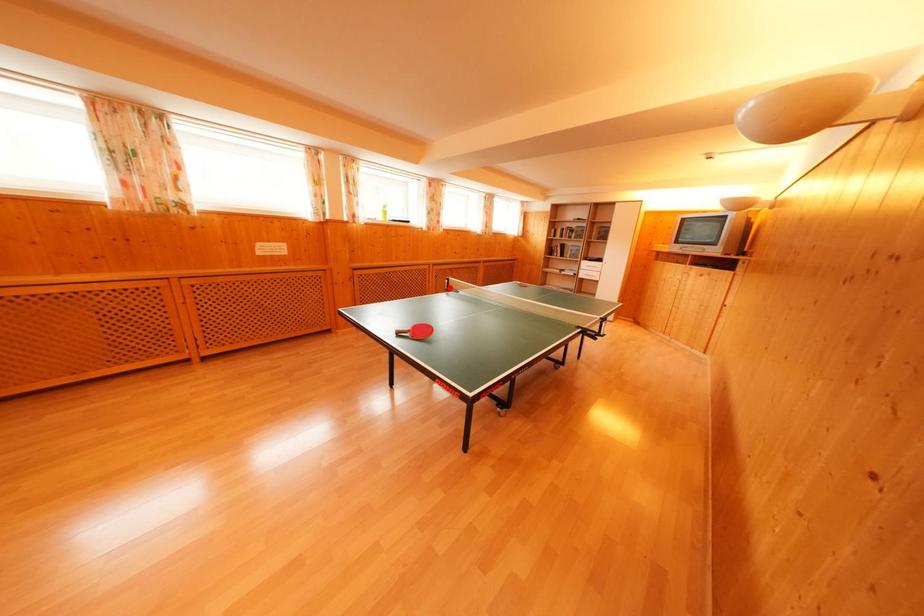
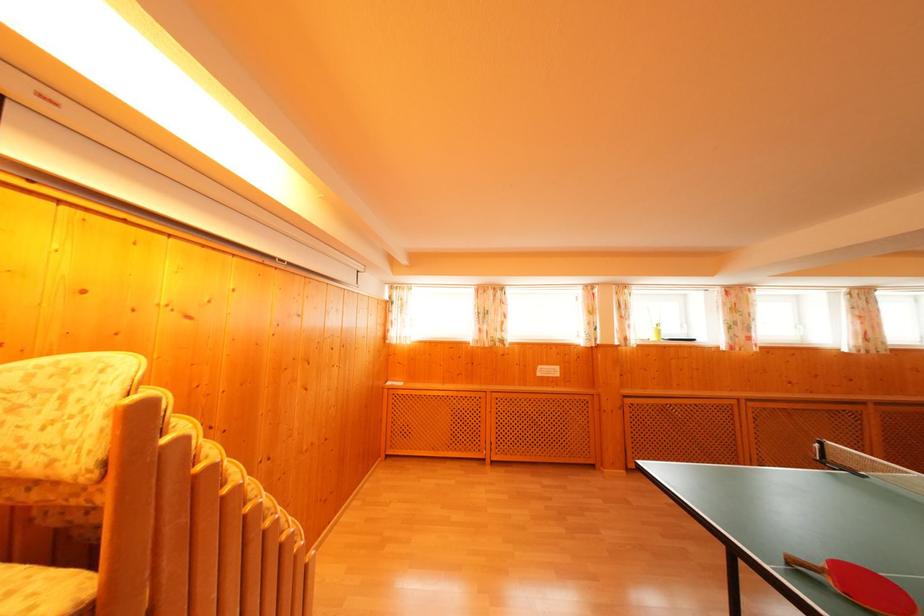
The point at the highlighted location is marked in the first image. Where is the corresponding point in the second image?

(817, 453)